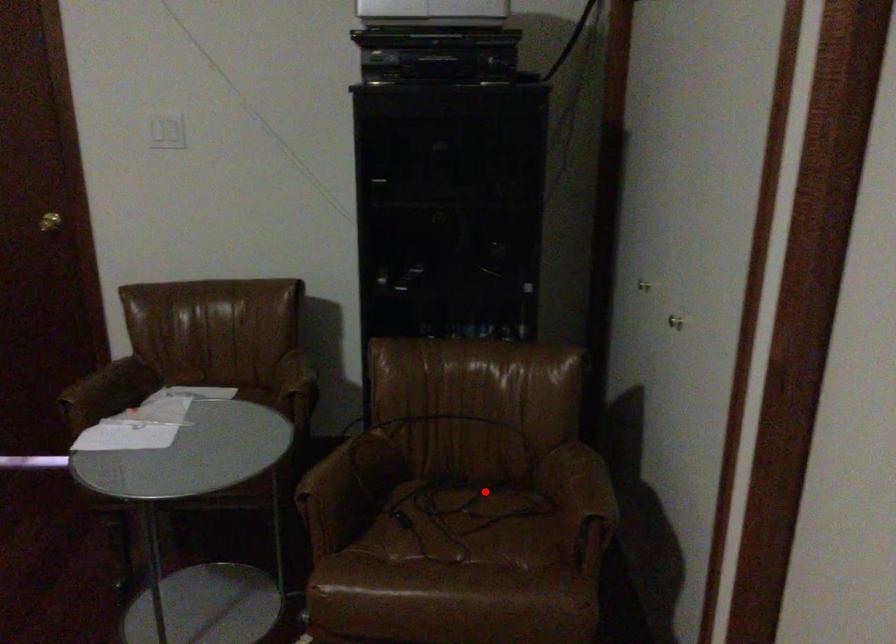
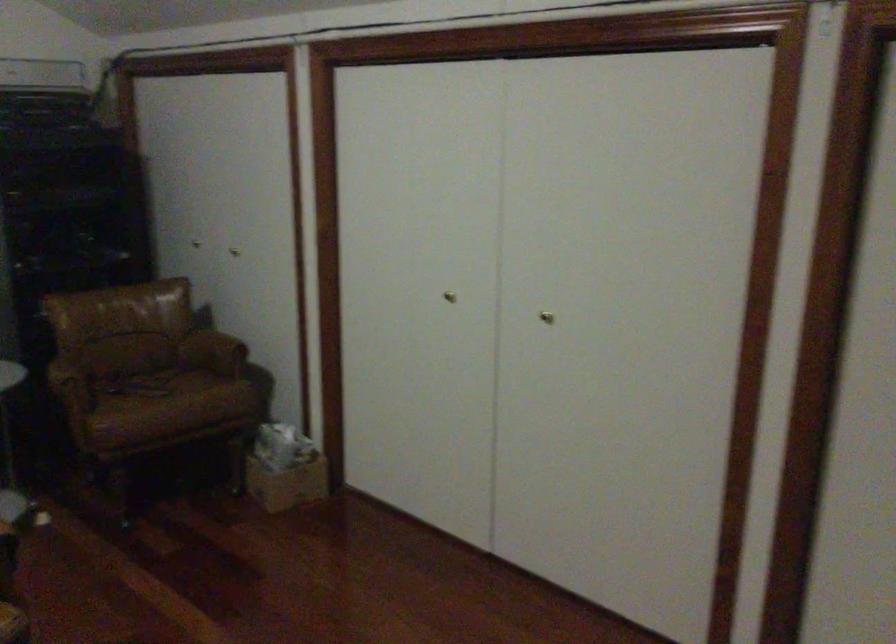
Where in the second image is the point corresponding to the highlighted location from the first image?

(149, 370)